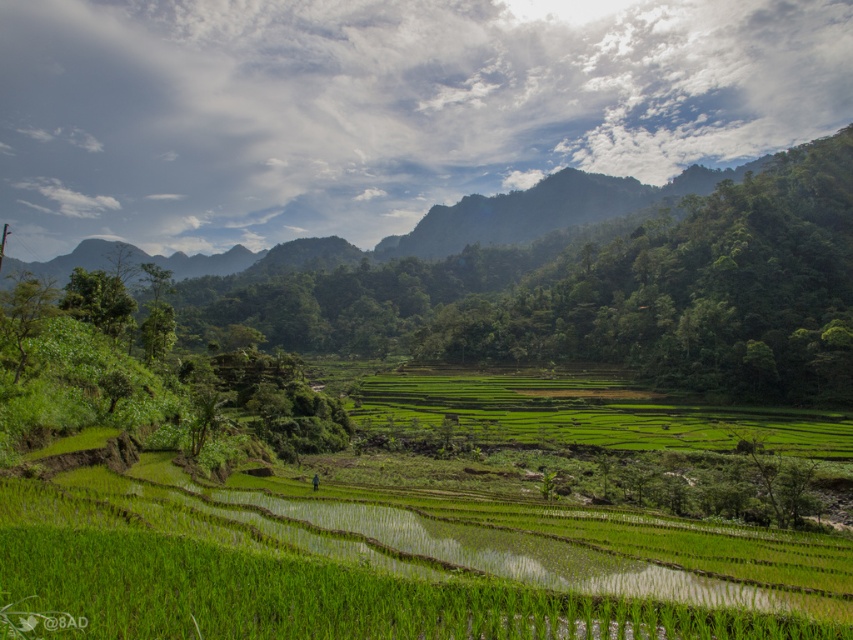
You are standing at the point with coordinates point (345,572) in the rural landscape scene. What type of terrain are you currently standing on?

The point (345,572) corresponds to a green grassy rice field at center.

You are standing at the edge of the scene and want to walk to the green grassy rice field at center and the green grassy field at center. Which one is located to the left?

The green grassy rice field at center is positioned on the left side of green grassy field at center.

You are standing at the top of the terraced rice fields and looking down. There are two green grassy fields in front of you. Which one is closer to you? The options are the green grassy rice field at center and the green grassy field at center.

The green grassy rice field at center is closer because it is in front of the green grassy field at center.